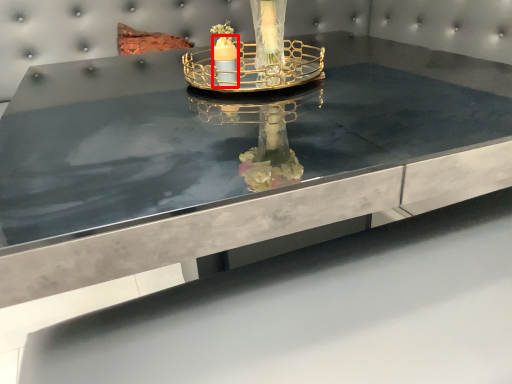
Question: From the image, what is the correct spatial relationship of candle (annotated by the red box) in relation to candle holder?

Choices:
 (A) right
 (B) left

Answer: (B)